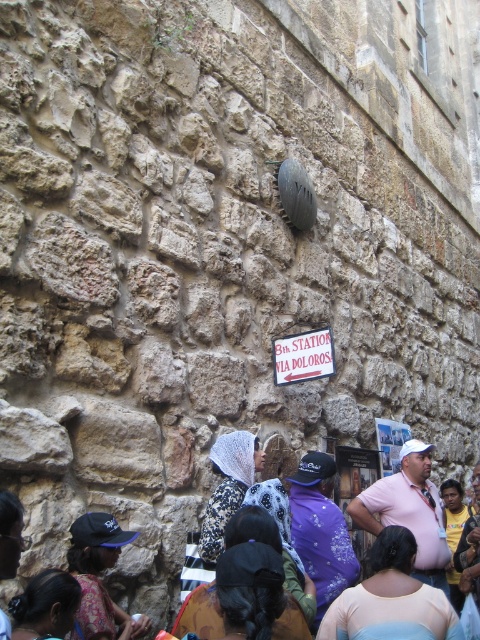
You are a tourist standing in front of the large stone wall and want to pick up the matte black cap at lower left. Is the cap closer to you than the white paper sign at center?

Yes, the matte black cap at lower left is closer to the viewer than the white paper sign at center.

You are standing in front of the large stone wall with the 8th STATION VIA DOLOROSA sign. You notice a printed fabric headscarf at center and dark brown hair at lower left. Which object is closer to you?

The printed fabric headscarf at center is closer to you than the dark brown hair at lower left.